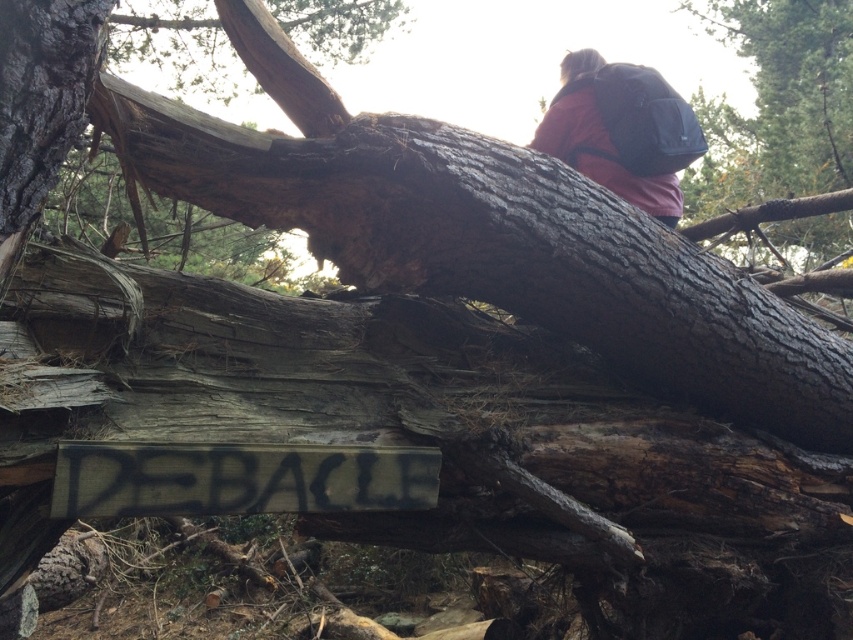
Is dark brown bark at upper right positioned in front of black painted wood sign at center?

That is False.

Locate an element on the screen. dark brown bark at upper right is located at coordinates (776, 104).

Where is `dark brown bark at upper right`? The image size is (853, 640). dark brown bark at upper right is located at coordinates (776, 104).

Is dark brown bark at upper right further to the viewer compared to red fabric backpack at upper right?

Yes, dark brown bark at upper right is further from the viewer.

Locate an element on the screen. This screenshot has width=853, height=640. dark brown bark at upper right is located at coordinates (776, 104).

Find the location of `dark brown bark at upper right`. dark brown bark at upper right is located at coordinates (776, 104).

Looking at this image, who is shorter, black painted wood sign at center or red fabric backpack at upper right?

Standing shorter between the two is black painted wood sign at center.

Is point (239, 486) positioned in front of point (662, 196)?

Yes, it is.

The image size is (853, 640). In order to click on black painted wood sign at center in this screenshot , I will do `click(239, 477)`.